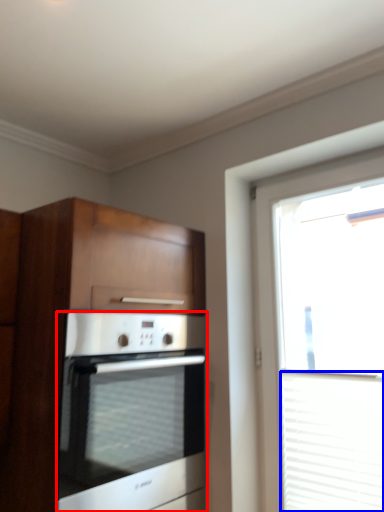
Question: Which of the following is the closest to the observer, oven (highlighted by a red box) or blind (highlighted by a blue box)?

Choices:
 (A) oven
 (B) blind

Answer: (A)